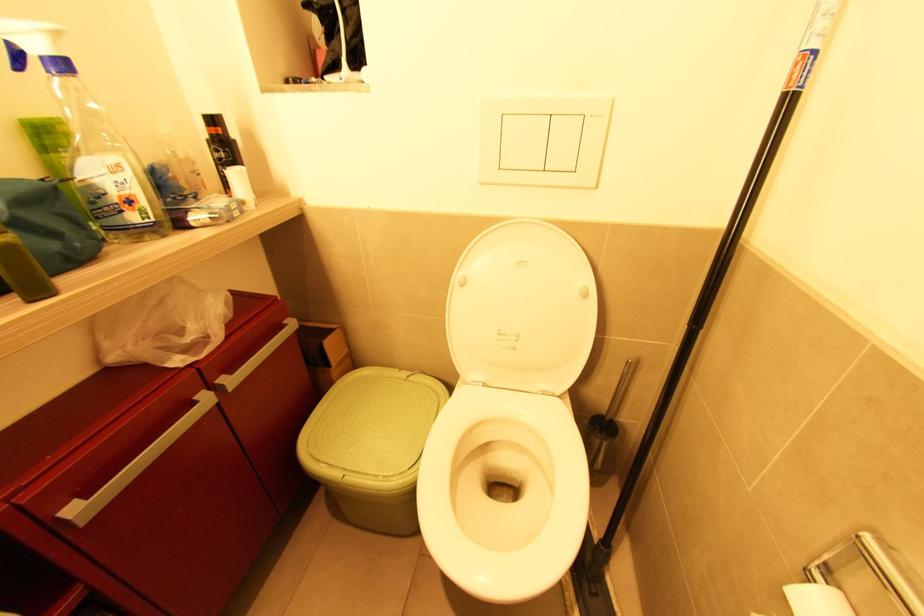
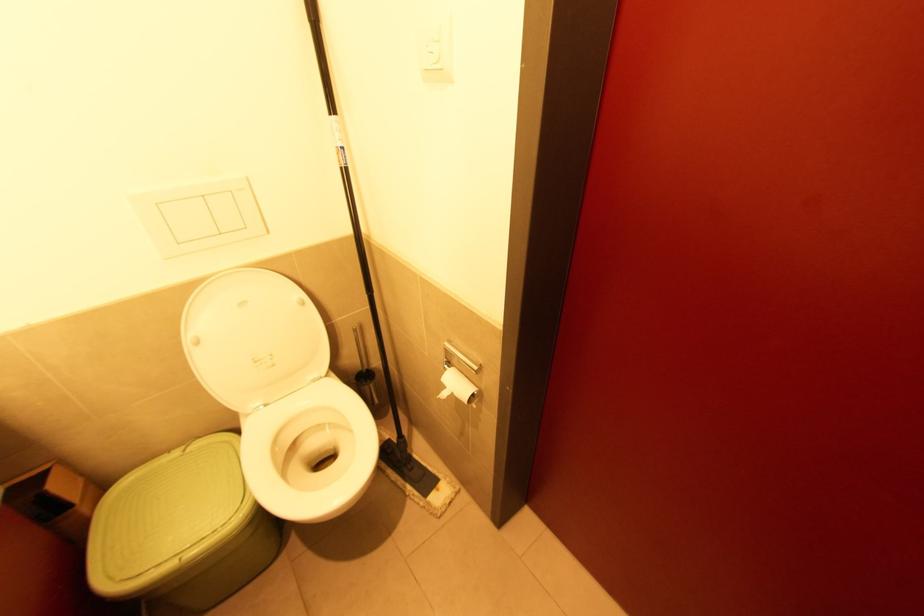
The point at (594, 415) is marked in the first image. Where is the corresponding point in the second image?

(358, 374)